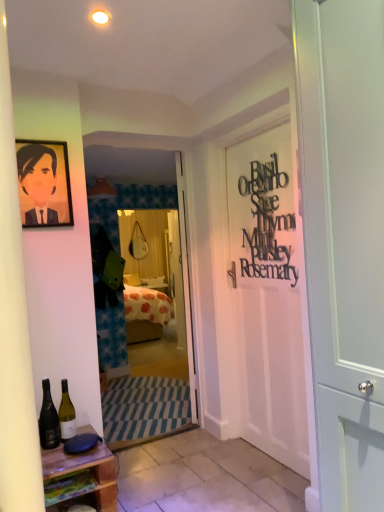
Question: From the image's perspective, does wooden at lower left appear higher than white matte door at center, the 1th door when ordered from right to left?

Choices:
 (A) no
 (B) yes

Answer: (A)

Question: From the image's perspective, is wooden at lower left below white matte door at center, the 1th door when ordered from front to back?

Choices:
 (A) no
 (B) yes

Answer: (B)

Question: Would you say white matte door at center, acting as the second door starting from the back, is part of wooden at lower left's contents?

Choices:
 (A) no
 (B) yes

Answer: (A)

Question: Is wooden at lower left next to white matte door at center, acting as the second door starting from the back?

Choices:
 (A) yes
 (B) no

Answer: (B)

Question: Can you confirm if wooden at lower left is smaller than white matte door at center, the 1th door when ordered from front to back?

Choices:
 (A) no
 (B) yes

Answer: (B)

Question: Could you tell me if wooden at lower left is turned towards white matte door at center, the 1th door when ordered from front to back?

Choices:
 (A) no
 (B) yes

Answer: (A)

Question: Considering the relative sizes of black metallic sign at right and white tile at lower center in the image provided, is black metallic sign at right smaller than white tile at lower center?

Choices:
 (A) no
 (B) yes

Answer: (B)

Question: Is black metallic sign at right positioned beyond the bounds of white tile at lower center?

Choices:
 (A) no
 (B) yes

Answer: (B)

Question: From a real-world perspective, is black metallic sign at right under white tile at lower center?

Choices:
 (A) no
 (B) yes

Answer: (A)

Question: From the image's perspective, is black metallic sign at right under white tile at lower center?

Choices:
 (A) no
 (B) yes

Answer: (A)

Question: Can you confirm if black metallic sign at right is bigger than white tile at lower center?

Choices:
 (A) no
 (B) yes

Answer: (A)

Question: From the image's perspective, would you say black metallic sign at right is positioned over white tile at lower center?

Choices:
 (A) no
 (B) yes

Answer: (B)

Question: Can you confirm if white tile at lower center is positioned to the left of dark green glass bottle at lower left, which is the second bottle from right to left?

Choices:
 (A) no
 (B) yes

Answer: (A)